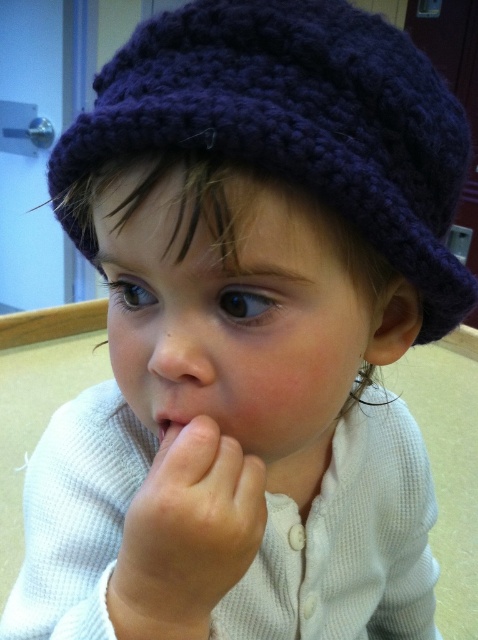
Which is more to the left, dark blue knitted hat at upper center or smooth skin nose at center?

Positioned to the left is smooth skin nose at center.

Is dark blue knitted hat at upper center thinner than smooth skin nose at center?

No.

Who is more distant from viewer, (437, 136) or (205, 380)?

Positioned behind is point (437, 136).

The image size is (478, 640). In order to click on dark blue knitted hat at upper center in this screenshot , I will do tap(290, 125).

Which of these two, smooth skin hand at center or smooth skin nose at center, stands shorter?

Standing shorter between the two is smooth skin nose at center.

You are a GUI agent. You are given a task and a screenshot of the screen. Output one action in this format:
    pyautogui.click(x=<x>, y=<y>)
    Task: Click on the smooth skin hand at center
    The image size is (478, 640).
    Given the screenshot: What is the action you would take?
    pyautogui.click(x=186, y=534)

Identify the location of dark blue knitted hat at upper center. The height and width of the screenshot is (640, 478). (290, 125).

Is dark blue knitted hat at upper center positioned before smooth skin hand at center?

Yes, it is in front of smooth skin hand at center.

Is point (173, 92) closer to viewer compared to point (132, 547)?

Yes, point (173, 92) is in front of point (132, 547).

This screenshot has height=640, width=478. Find the location of `dark blue knitted hat at upper center`. dark blue knitted hat at upper center is located at coordinates (290, 125).